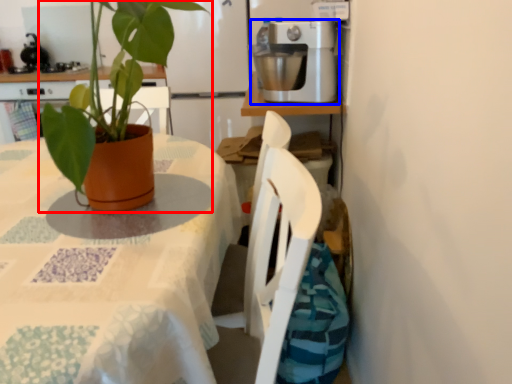
Question: Which object appears closest to the camera in this image, houseplant (highlighted by a red box) or kitchen appliance (highlighted by a blue box)?

Choices:
 (A) houseplant
 (B) kitchen appliance

Answer: (A)